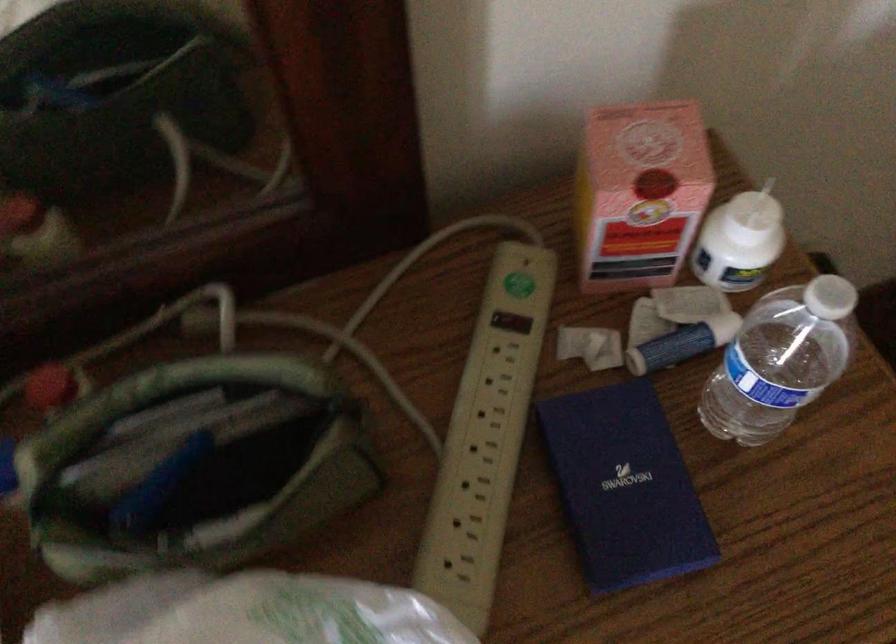
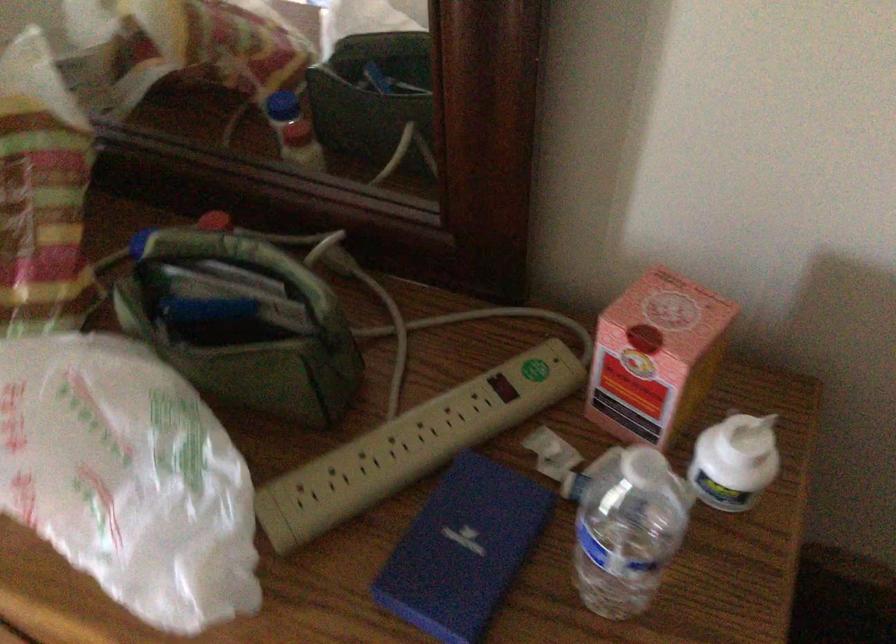
Find the pixel in the second image that matches pixel 214 462 in the first image.

(239, 322)